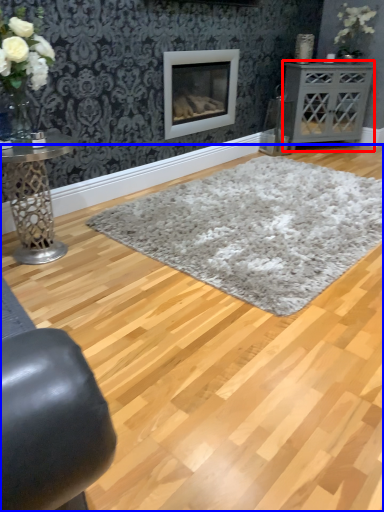
Question: Which of the following is the farthest to the observer, table (highlighted by a red box) or plain (highlighted by a blue box)?

Choices:
 (A) table
 (B) plain

Answer: (A)